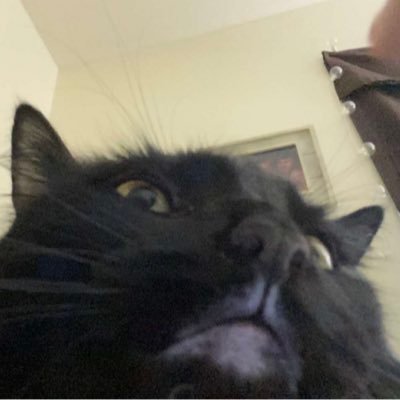
The image size is (400, 400). Find the location of `picture`. picture is located at coordinates pos(296,172).